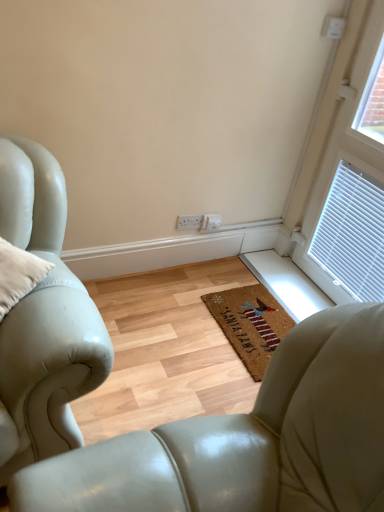
Where is `vacant area situated below coir mat at center (from a real-world perspective)`? The height and width of the screenshot is (512, 384). vacant area situated below coir mat at center (from a real-world perspective) is located at coordinates (253, 316).